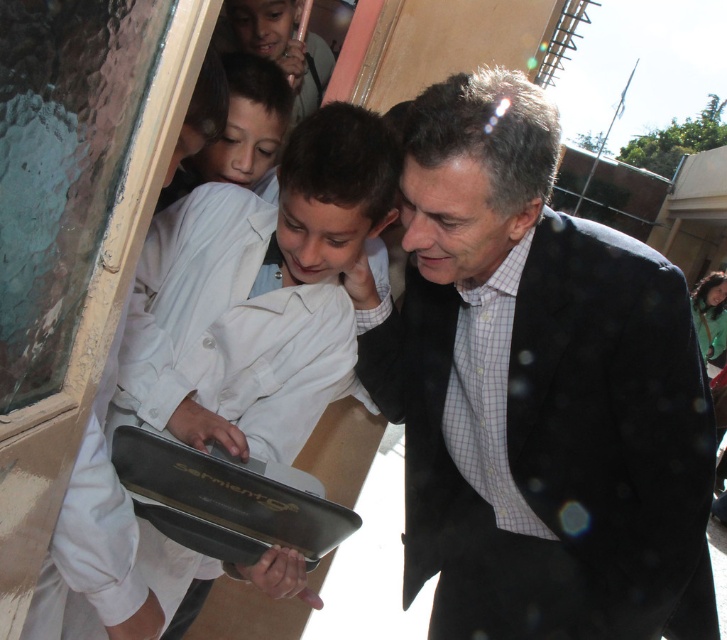
Question: Among these objects, which one is nearest to the camera?

Choices:
 (A) dark blue suit at center
 (B) white matte laptop at center

Answer: (A)

Question: Which of the following is the farthest from the observer?

Choices:
 (A) white matte laptop at center
 (B) dark blue suit at center

Answer: (A)

Question: Is dark blue suit at center below white matte laptop at center?

Choices:
 (A) no
 (B) yes

Answer: (B)

Question: Among these points, which one is farthest from the camera?

Choices:
 (A) (494, 157)
 (B) (308, 196)

Answer: (B)

Question: Is dark blue suit at center below white matte laptop at center?

Choices:
 (A) yes
 (B) no

Answer: (A)

Question: Considering the relative positions of dark blue suit at center and white matte laptop at center in the image provided, where is dark blue suit at center located with respect to white matte laptop at center?

Choices:
 (A) left
 (B) right

Answer: (B)